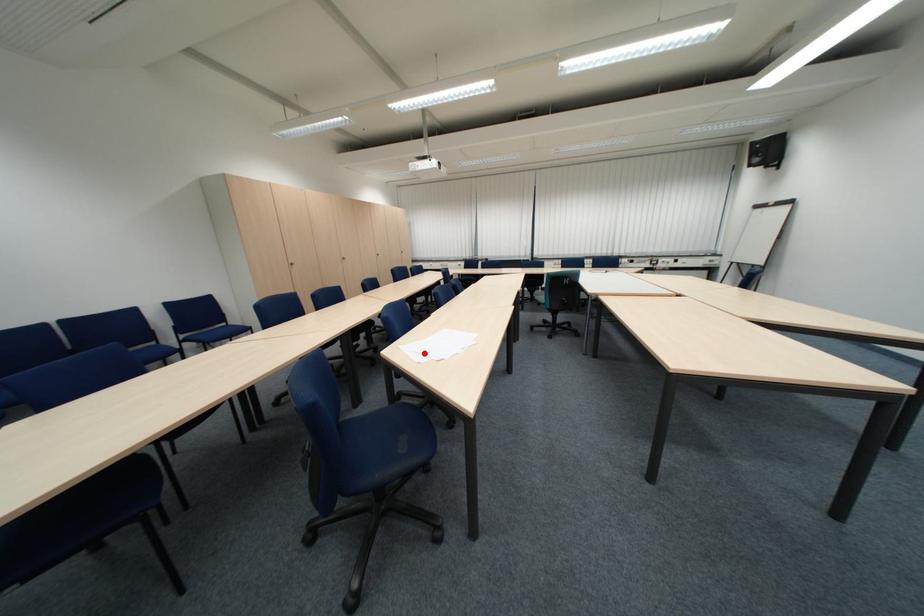
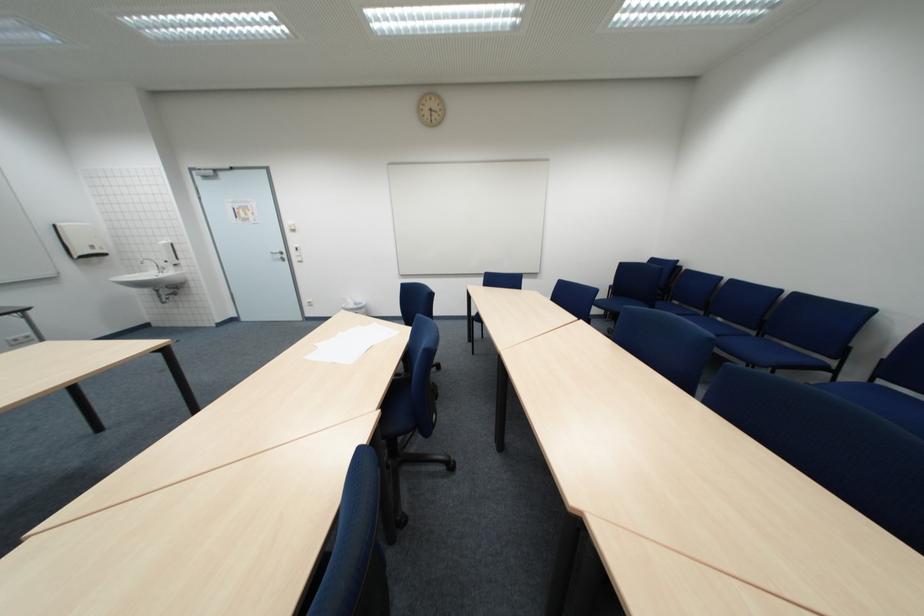
Question: I am providing you with two images of the same scene from different viewpoints. A red point is marked on the first image. Can you still see the location of the red point in image 2?

Choices:
 (A) Yes
 (B) No

Answer: (B)